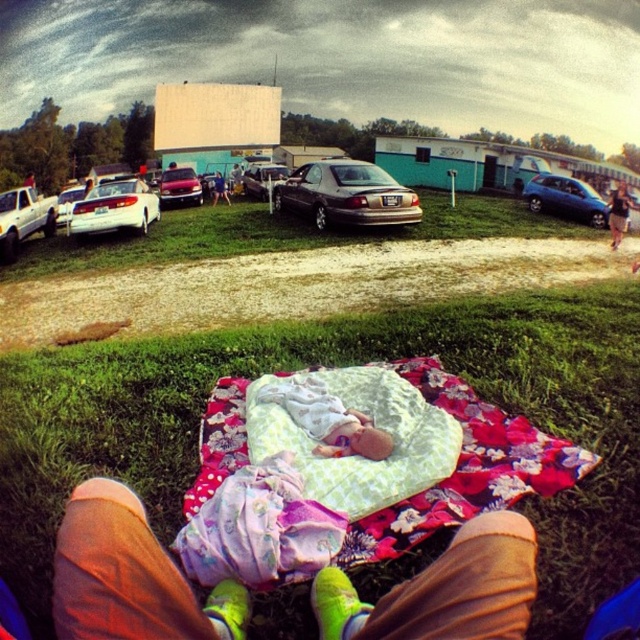
Does floral fabric blanket at center have a smaller size compared to shiny silver sedan at center?

No.

This screenshot has width=640, height=640. I want to click on floral fabric blanket at center, so coord(353,472).

From the picture: Between soft white blanket at center and blue metallic hatchback at right, which one appears on the left side from the viewer's perspective?

soft white blanket at center is more to the left.

Image resolution: width=640 pixels, height=640 pixels. I want to click on soft white blanket at center, so click(326, 419).

Where is `soft white blanket at center`? The height and width of the screenshot is (640, 640). soft white blanket at center is located at coordinates (326, 419).

Is floral fabric blanket at center wider than shiny red car at center?

Correct, the width of floral fabric blanket at center exceeds that of shiny red car at center.

Which is more to the left, floral fabric blanket at center or shiny red car at center?

shiny red car at center is more to the left.

Does point (236, 531) come closer to viewer compared to point (172, 186)?

That is True.

This screenshot has width=640, height=640. Find the location of `floral fabric blanket at center`. floral fabric blanket at center is located at coordinates (353, 472).